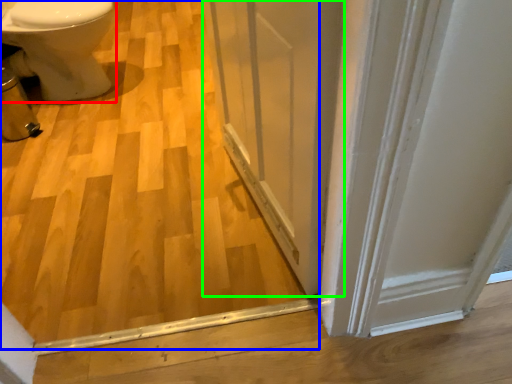
Question: Considering the real-world distances, which object is closest to bidet (highlighted by a red box)? plywood (highlighted by a blue box) or screen door (highlighted by a green box).

Choices:
 (A) plywood
 (B) screen door

Answer: (A)